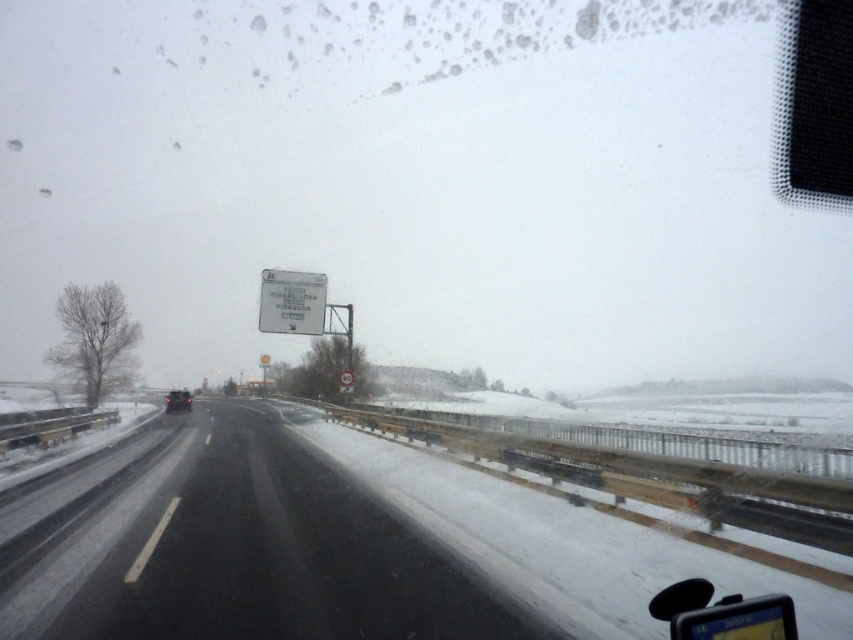
From the picture: You are a driver navigating a snowy highway. You notice the black asphalt highway at center and the white paper sign at upper center. Which object appears taller in the image?

The white paper sign at upper center appears taller than the black asphalt highway at center in the image.

You are driving a car that is 4.5 meters long. You see the white paper sign at upper center ahead and your matte black car at center. Can your car safely pass through the space between them without any part of your car touching either object?

The distance between the white paper sign at upper center and the matte black car at center is 18.26 meters. Since your car is only 4.5 meters long, there is sufficient space for it to pass through safely without touching either object.

While driving on a snowy highway, you notice a black asphalt highway at center and a white paper sign at upper center. Which object appears bigger in the scene?

The black asphalt highway at center appears larger in size than the white paper sign at upper center.